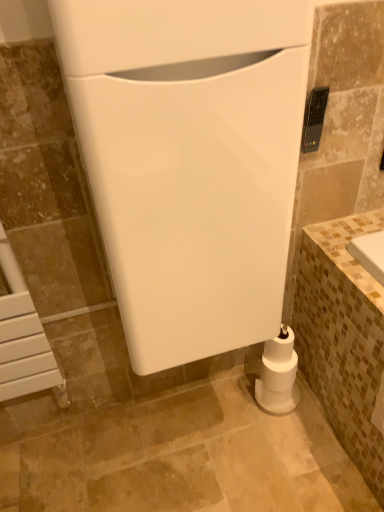
Question: Which is correct: white matte toilet paper at lower right is inside white glossy toilet at center, which is the second appliance in back-to-front order, or outside of it?

Choices:
 (A) inside
 (B) outside

Answer: (B)

Question: From a real-world perspective, relative to white glossy toilet at center, marked as the first appliance in a front-to-back arrangement, is white matte toilet paper at lower right vertically above or below?

Choices:
 (A) above
 (B) below

Answer: (B)

Question: Estimate the real-world distances between objects in this image. Which object is closer to the black plastic remote control at upper right, arranged as the second appliance when viewed from the front?

Choices:
 (A) white glossy toilet at center, marked as the first appliance in a front-to-back arrangement
 (B) white matte toilet paper at lower right

Answer: (A)

Question: Considering the real-world distances, which object is closest to the white matte toilet paper at lower right?

Choices:
 (A) black plastic remote control at upper right, arranged as the first appliance when viewed from the right
 (B) white glossy toilet at center, which is the second appliance in back-to-front order

Answer: (B)